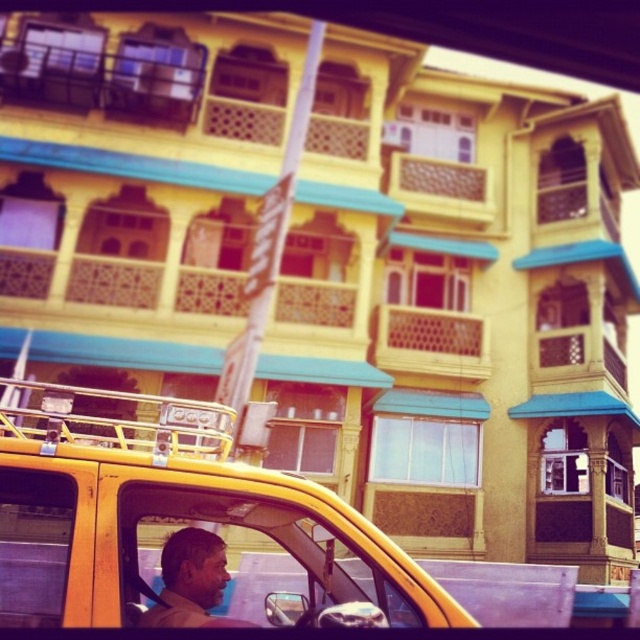
Consider the image. You are a delivery person who needs to load a package onto the roof rack of the yellow matte taxi at center. The package is as tall as the matte brown skin at center. Will the package fit under the overhang of the building without hitting the roof rack?

The yellow matte taxi at center is taller than the matte brown skin at center. Since the package is as tall as the matte brown skin at center, it will be shorter than the taxi. Therefore, the package should fit under the overhang of the building without hitting the roof rack.

You are a delivery person who needs to check the weather outside. You have a transparent plastic window at center and a matte brown skin at center in your view. Which object would allow you to see the weather clearly?

The transparent plastic window at center is bigger than matte brown skin at center, so the transparent plastic window at center would allow you to see the weather clearly as it is transparent and larger in size.

You are a pedestrian standing in the middle of the street. You see a yellow matte taxi at center and a matte brown skin at center. Which object is higher from the ground?

The yellow matte taxi at center is located above matte brown skin at center, so the yellow matte taxi at center is higher from the ground.